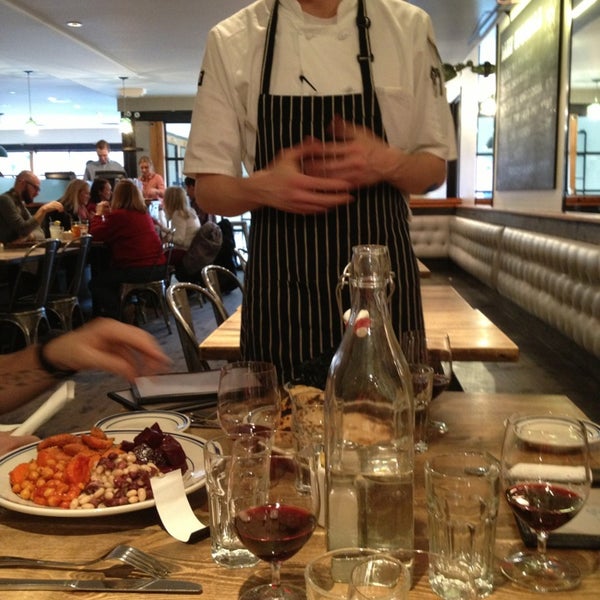
Where is `white dinner plate`? This screenshot has width=600, height=600. white dinner plate is located at coordinates (8, 492).